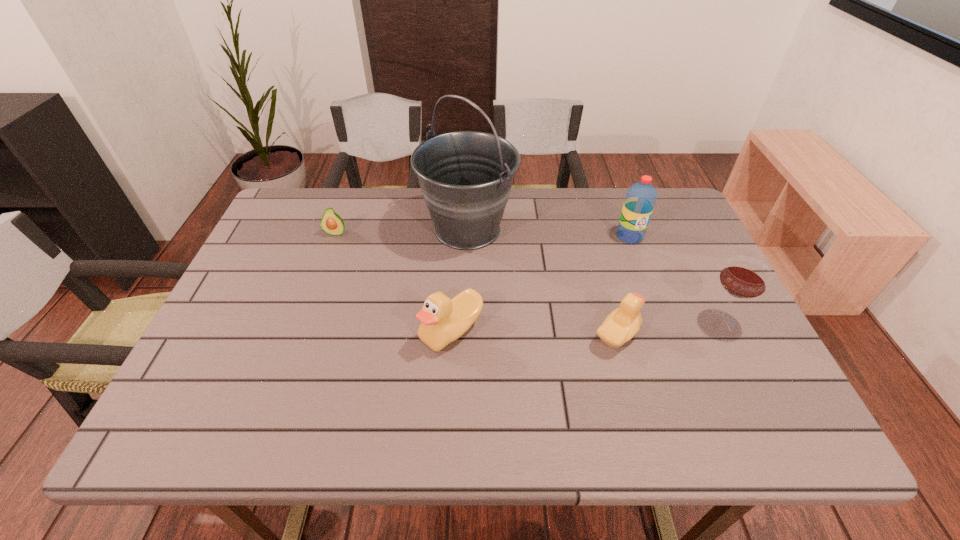
Locate an element on the screen. The image size is (960, 540). vacant space located 0.090m at the beak of the left duck is located at coordinates (381, 330).

The width and height of the screenshot is (960, 540). Identify the location of vacant area situated at the beak of the left duck. (271, 330).

Locate an element on the screen. The width and height of the screenshot is (960, 540). vacant space located at the beak of the left duck is located at coordinates (335, 330).

At what (x,y) coordinates should I click in order to perform the action: click on blank space located 0.070m at the beak of the right duck. Please return your answer as a coordinate pair (x, y). The image size is (960, 540). Looking at the image, I should click on (672, 335).

Locate an element on the screen. free spot located on the right of the tallest object is located at coordinates (566, 229).

What are the coordinates of `free point located 0.360m on the front label of the second tallest object` in the screenshot? It's located at [672, 349].

I want to click on vacant position located 0.260m on the cut side of the leftmost object, so click(x=309, y=306).

Locate an element on the screen. vacant space situated on the left of the wineglass is located at coordinates (612, 320).

In order to click on bucket at the far edge in this screenshot , I will do `click(466, 177)`.

Image resolution: width=960 pixels, height=540 pixels. I want to click on water bottle positioned at the far edge, so click(641, 197).